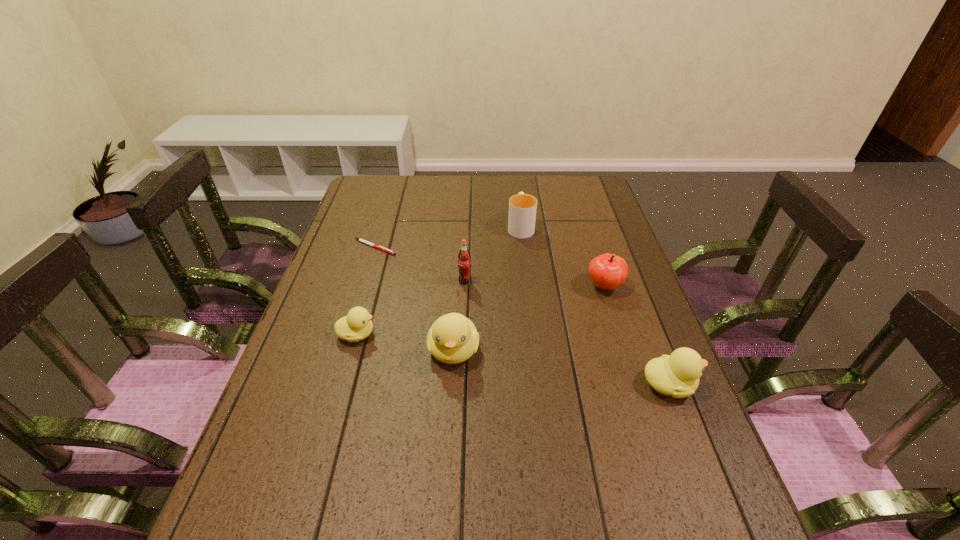
Find the location of a particular element. This screenshot has width=960, height=540. free spot between the rightmost duckling and the fifth object from left to right is located at coordinates (595, 306).

Locate an element on the screen. The image size is (960, 540). free point between the shortest duckling and the second tallest duckling is located at coordinates (513, 359).

Where is `free spot between the apple and the soda bottle`? free spot between the apple and the soda bottle is located at coordinates (535, 284).

You are a GUI agent. You are given a task and a screenshot of the screen. Output one action in this format:
    pyautogui.click(x=<x>, y=<y>)
    Task: Click on the blank region between the apple and the soda bottle
    The image size is (960, 540).
    Given the screenshot: What is the action you would take?
    pyautogui.click(x=535, y=284)

Where is `free area in between the shortest object and the tallest duckling`? free area in between the shortest object and the tallest duckling is located at coordinates (414, 299).

Image resolution: width=960 pixels, height=540 pixels. What are the coordinates of `vacant space in between the sixth nearest object and the soda bottle` in the screenshot? It's located at (420, 265).

Identify which object is located as the third nearest to the second duckling from right to left. Please provide its 2D coordinates. Your answer should be formatted as a tuple, i.e. [(x, y)], where the tuple contains the x and y coordinates of a point satisfying the conditions above.

[(608, 271)]

The height and width of the screenshot is (540, 960). I want to click on object that stands as the fifth closest to the pen, so click(608, 271).

Identify which duckling is located as the nearest to the apple. Please provide its 2D coordinates. Your answer should be formatted as a tuple, i.e. [(x, y)], where the tuple contains the x and y coordinates of a point satisfying the conditions above.

[(677, 375)]

Locate an element on the screen. duckling that is the closest one to the second tallest duckling is located at coordinates (453, 338).